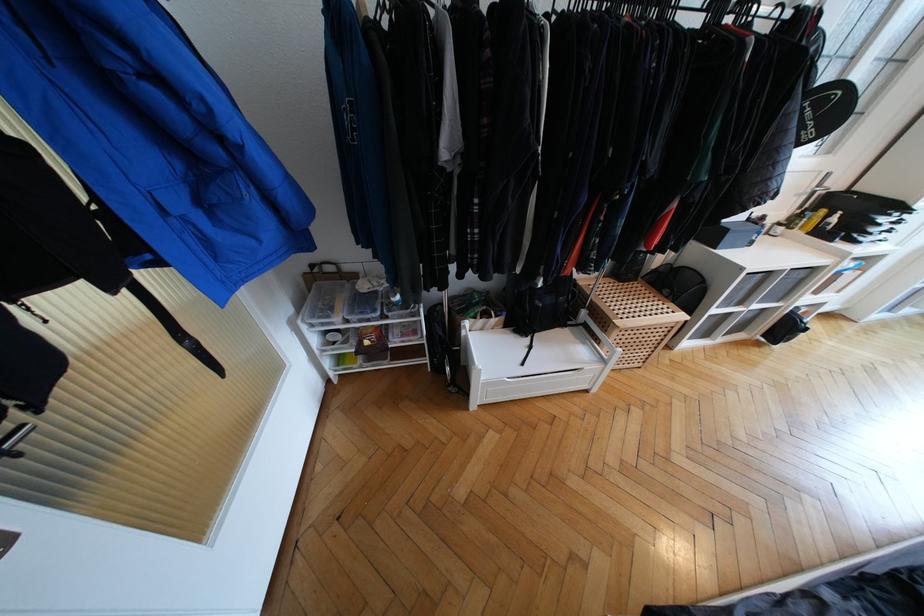
Find where to lift the perforated wooden lid. Please return your answer as a coordinate pair (x, y).

(629, 300)